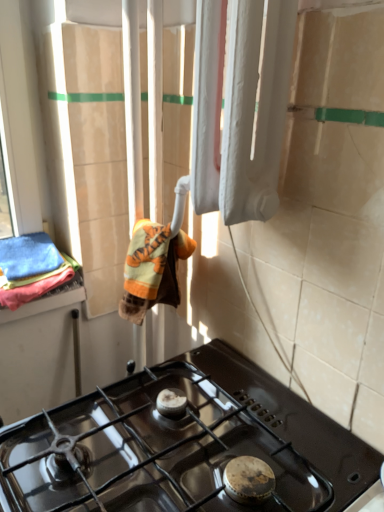
The width and height of the screenshot is (384, 512). What do you see at coordinates (152, 269) in the screenshot?
I see `orange plush bath towel at center, acting as the second bath towel starting from the left` at bounding box center [152, 269].

Where is `orange plush bath towel at center, which appears as the 1th bath towel when viewed from the right`? The height and width of the screenshot is (512, 384). orange plush bath towel at center, which appears as the 1th bath towel when viewed from the right is located at coordinates (152, 269).

In order to face soft cotton towels at left, the 2th bath towel from the right, should I rotate leftwards or rightwards?

Rotate your view left by about 20.373°.

Image resolution: width=384 pixels, height=512 pixels. Find the location of `orange plush bath towel at center, acting as the second bath towel starting from the left`. orange plush bath towel at center, acting as the second bath towel starting from the left is located at coordinates (152, 269).

Is white matte radiator at upper center surrounded by black glass gas stove at lower center?

No, white matte radiator at upper center is not surrounded by black glass gas stove at lower center.

Considering the positions of points (325, 468) and (279, 102), is point (325, 468) closer to camera compared to point (279, 102)?

Yes, point (325, 468) is in front of point (279, 102).

In the scene shown: From the image's perspective, which object appears higher, black glass gas stove at lower center or white matte radiator at upper center?

white matte radiator at upper center appears higher in the image.

Considering the positions of objects orange plush bath towel at center, acting as the second bath towel starting from the left, and white matte radiator at upper center in the image provided, who is behind, orange plush bath towel at center, acting as the second bath towel starting from the left, or white matte radiator at upper center?

orange plush bath towel at center, acting as the second bath towel starting from the left, is further away from the camera.

From a real-world perspective, is orange plush bath towel at center, acting as the second bath towel starting from the left, positioned under white matte radiator at upper center based on gravity?

Yes, from a real-world perspective, orange plush bath towel at center, acting as the second bath towel starting from the left, is below white matte radiator at upper center.

Looking at the image, does orange plush bath towel at center, acting as the second bath towel starting from the left, seem bigger or smaller compared to white matte radiator at upper center?

Considering their sizes, orange plush bath towel at center, acting as the second bath towel starting from the left, takes up less space than white matte radiator at upper center.

Which is more to the right, orange plush bath towel at center, which appears as the 1th bath towel when viewed from the right, or white matte radiator at upper center?

white matte radiator at upper center.

Considering the relative positions of white matte radiator at upper center and soft cotton towels at left, marked as the first bath towel in a left-to-right arrangement, in the image provided, is white matte radiator at upper center to the left of soft cotton towels at left, marked as the first bath towel in a left-to-right arrangement, from the viewer's perspective?

In fact, white matte radiator at upper center is to the right of soft cotton towels at left, marked as the first bath towel in a left-to-right arrangement.

How different are the orientations of white matte radiator at upper center and soft cotton towels at left, the 2th bath towel from the right, in degrees?

87 degrees separate the facing orientations of white matte radiator at upper center and soft cotton towels at left, the 2th bath towel from the right.

Is white matte radiator at upper center shorter than soft cotton towels at left, the 2th bath towel from the right?

In fact, white matte radiator at upper center may be taller than soft cotton towels at left, the 2th bath towel from the right.

Looking at their sizes, would you say white matte radiator at upper center is wider or thinner than soft cotton towels at left, the 2th bath towel from the right?

Considering their sizes, white matte radiator at upper center looks slimmer than soft cotton towels at left, the 2th bath towel from the right.

Looking at this image, does orange plush bath towel at center, acting as the second bath towel starting from the left, turn towards soft cotton towels at left, marked as the first bath towel in a left-to-right arrangement?

No, orange plush bath towel at center, acting as the second bath towel starting from the left, does not turn towards soft cotton towels at left, marked as the first bath towel in a left-to-right arrangement.

What's the angular difference between orange plush bath towel at center, which appears as the 1th bath towel when viewed from the right, and soft cotton towels at left, the 2th bath towel from the right,'s facing directions?

The angular difference between orange plush bath towel at center, which appears as the 1th bath towel when viewed from the right, and soft cotton towels at left, the 2th bath towel from the right, is 68.8 degrees.

Is orange plush bath towel at center, acting as the second bath towel starting from the left, located outside soft cotton towels at left, the 2th bath towel from the right?

Yes, orange plush bath towel at center, acting as the second bath towel starting from the left, is located beyond the bounds of soft cotton towels at left, the 2th bath towel from the right.

Which is in front, orange plush bath towel at center, acting as the second bath towel starting from the left, or soft cotton towels at left, marked as the first bath towel in a left-to-right arrangement?

orange plush bath towel at center, acting as the second bath towel starting from the left, is closer to the camera.

Is black glass gas stove at lower center located within soft cotton towels at left, the 2th bath towel from the right?

Answer: No, soft cotton towels at left, the 2th bath towel from the right, does not contain black glass gas stove at lower center.

Is soft cotton towels at left, the 2th bath towel from the right, not close to black glass gas stove at lower center?

soft cotton towels at left, the 2th bath towel from the right, is actually quite close to black glass gas stove at lower center.

From the image's perspective, between soft cotton towels at left, the 2th bath towel from the right, and black glass gas stove at lower center, which one is located above?

From the image's view, soft cotton towels at left, the 2th bath towel from the right, is above.

How distant is soft cotton towels at left, the 2th bath towel from the right, from black glass gas stove at lower center?

soft cotton towels at left, the 2th bath towel from the right, and black glass gas stove at lower center are 20.53 inches apart.

Does white matte radiator at upper center have a greater height compared to black glass gas stove at lower center?

Correct, white matte radiator at upper center is much taller as black glass gas stove at lower center.

Locate an element on the screen. gas stove that appears on the left of white matte radiator at upper center is located at coordinates (212, 439).

Considering the positions of objects white matte radiator at upper center and black glass gas stove at lower center in the image provided, who is more to the right, white matte radiator at upper center or black glass gas stove at lower center?

white matte radiator at upper center is more to the right.

Who is bigger, white matte radiator at upper center or black glass gas stove at lower center?

Bigger between the two is black glass gas stove at lower center.

Can you confirm if black glass gas stove at lower center is shorter than soft cotton towels at left, marked as the first bath towel in a left-to-right arrangement?

Incorrect, the height of black glass gas stove at lower center does not fall short of that of soft cotton towels at left, marked as the first bath towel in a left-to-right arrangement.

Which object is wider, black glass gas stove at lower center or soft cotton towels at left, marked as the first bath towel in a left-to-right arrangement?

With larger width is black glass gas stove at lower center.

Which is correct: black glass gas stove at lower center is inside soft cotton towels at left, marked as the first bath towel in a left-to-right arrangement, or outside of it?

black glass gas stove at lower center is outside soft cotton towels at left, marked as the first bath towel in a left-to-right arrangement.

The width and height of the screenshot is (384, 512). In the image, there is a black glass gas stove at lower center. Find the location of `curtain above it (from the image's perspective)`. curtain above it (from the image's perspective) is located at coordinates (241, 106).

Find the location of a particular element. This screenshot has width=384, height=512. the 1st bath towel positioned below the white matte radiator at upper center (from a real-world perspective) is located at coordinates (152, 269).

Considering their positions, is white matte radiator at upper center positioned closer to black glass gas stove at lower center than soft cotton towels at left, marked as the first bath towel in a left-to-right arrangement?

white matte radiator at upper center lies closer to black glass gas stove at lower center than the other object.

In the scene shown: Which object lies nearer to the anchor point white matte radiator at upper center, soft cotton towels at left, marked as the first bath towel in a left-to-right arrangement, or black glass gas stove at lower center?

Among the two, black glass gas stove at lower center is located nearer to white matte radiator at upper center.

Estimate the real-world distances between objects in this image. Which object is further from orange plush bath towel at center, acting as the second bath towel starting from the left, soft cotton towels at left, marked as the first bath towel in a left-to-right arrangement, or black glass gas stove at lower center?

The object further to orange plush bath towel at center, acting as the second bath towel starting from the left, is black glass gas stove at lower center.

Which object lies further to the anchor point white matte radiator at upper center, black glass gas stove at lower center or orange plush bath towel at center, which appears as the 1th bath towel when viewed from the right?

black glass gas stove at lower center lies further to white matte radiator at upper center than the other object.

Estimate the real-world distances between objects in this image. Which object is closer to orange plush bath towel at center, which appears as the 1th bath towel when viewed from the right, black glass gas stove at lower center or soft cotton towels at left, the 2th bath towel from the right?

Among the two, soft cotton towels at left, the 2th bath towel from the right, is located nearer to orange plush bath towel at center, which appears as the 1th bath towel when viewed from the right.

When comparing their distances from soft cotton towels at left, the 2th bath towel from the right, does orange plush bath towel at center, which appears as the 1th bath towel when viewed from the right, or white matte radiator at upper center seem further?

white matte radiator at upper center.

Looking at the image, which one is located further to soft cotton towels at left, the 2th bath towel from the right, white matte radiator at upper center or orange plush bath towel at center, acting as the second bath towel starting from the left?

white matte radiator at upper center lies further to soft cotton towels at left, the 2th bath towel from the right, than the other object.

From the image, which object appears to be nearer to black glass gas stove at lower center, orange plush bath towel at center, which appears as the 1th bath towel when viewed from the right, or soft cotton towels at left, the 2th bath towel from the right?

orange plush bath towel at center, which appears as the 1th bath towel when viewed from the right, is positioned closer to the anchor black glass gas stove at lower center.

I want to click on bath towel situated between soft cotton towels at left, the 2th bath towel from the right, and white matte radiator at upper center from left to right, so click(152, 269).

Locate an element on the screen. Image resolution: width=384 pixels, height=512 pixels. bath towel between black glass gas stove at lower center and soft cotton towels at left, marked as the first bath towel in a left-to-right arrangement, along the z-axis is located at coordinates (152, 269).